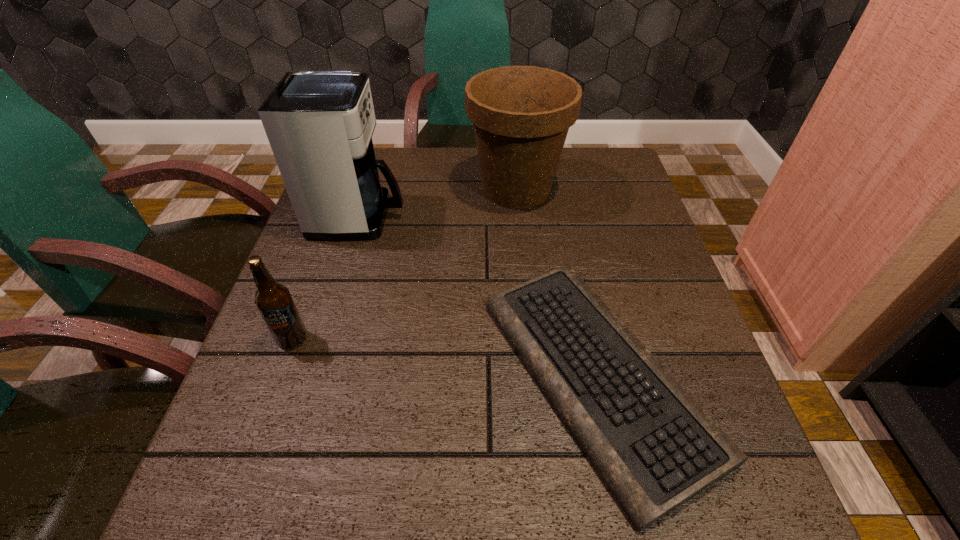
Where is `the tallest object`? This screenshot has height=540, width=960. the tallest object is located at coordinates (319, 124).

What are the coordinates of `the third shortest object` in the screenshot? It's located at (521, 115).

At what (x,y) coordinates should I click in order to perform the action: click on the third tallest object. Please return your answer as a coordinate pair (x, y). This screenshot has width=960, height=540. Looking at the image, I should click on (273, 300).

Where is `computer keyboard`? The height and width of the screenshot is (540, 960). computer keyboard is located at coordinates coord(655,448).

I want to click on free space located on the front panel of the coffee maker, so tap(499, 217).

Locate an element on the screen. free location located on the front of the third shortest object is located at coordinates (523, 260).

Image resolution: width=960 pixels, height=540 pixels. I want to click on free space located 0.290m on the label of the beer bottle, so [225, 527].

Identify the location of free space located 0.320m on the back of the computer keyboard. (557, 189).

Where is `coffee maker that is at the far edge`? Image resolution: width=960 pixels, height=540 pixels. coffee maker that is at the far edge is located at coordinates 319,124.

Where is `flowerpot positioned at the far edge`? flowerpot positioned at the far edge is located at coordinates [x=521, y=115].